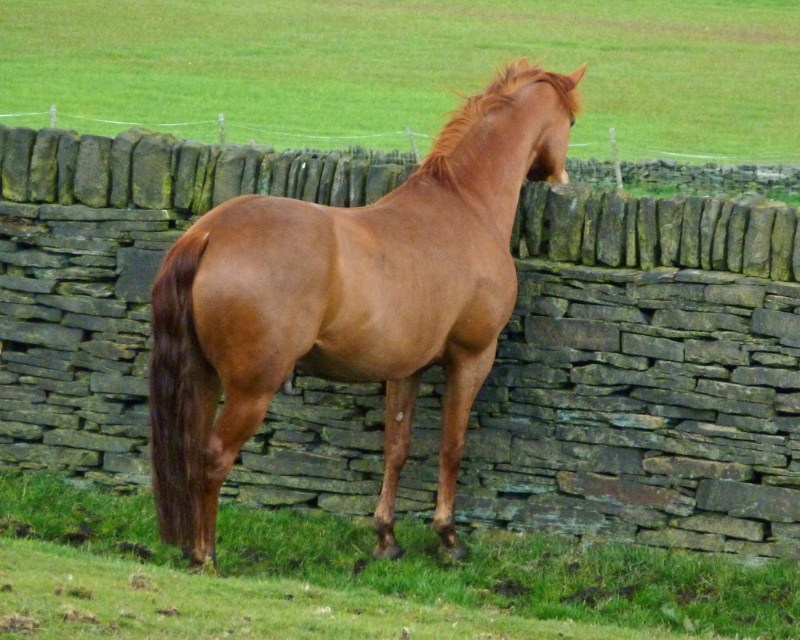
Question: Is green grass at center wider than green grass at lower center?

Choices:
 (A) yes
 (B) no

Answer: (A)

Question: Can you confirm if brown glossy horse at center is smaller than green grass at lower center?

Choices:
 (A) no
 (B) yes

Answer: (A)

Question: Among these points, which one is nearest to the camera?

Choices:
 (A) (740, 572)
 (B) (708, 38)
 (C) (428, 225)

Answer: (C)

Question: Considering the real-world distances, which object is closest to the brown glossy horse at center?

Choices:
 (A) green grass at lower center
 (B) green grass at center

Answer: (A)

Question: Which object appears closest to the camera in this image?

Choices:
 (A) green grass at center
 (B) green grass at lower center
 (C) brown glossy horse at center

Answer: (C)

Question: In this image, where is green grass at center located relative to brown glossy horse at center?

Choices:
 (A) below
 (B) above

Answer: (B)